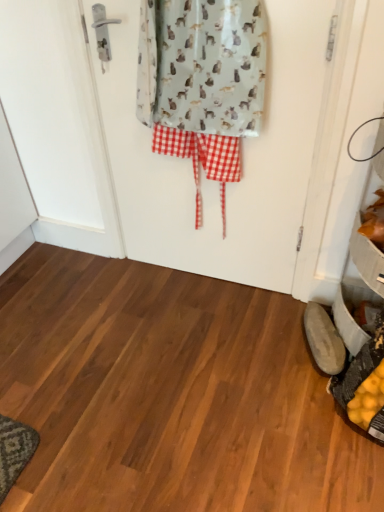
Locate an element on the screen. free space that is to the left of brown leather shoe at lower right is located at coordinates (270, 349).